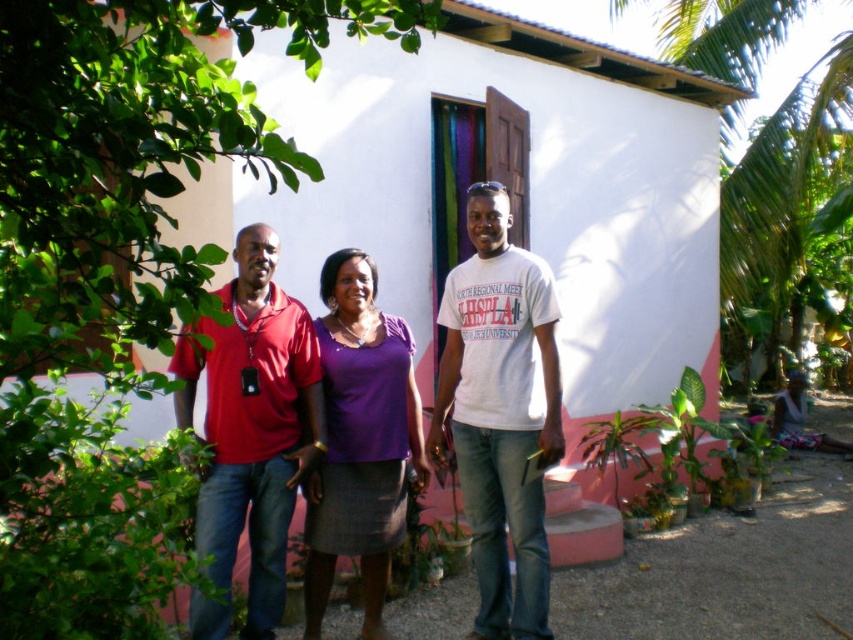
Question: Does white cotton t-shirt at center appear on the left side of matte red shirt at left?

Choices:
 (A) yes
 (B) no

Answer: (B)

Question: Does white cotton t-shirt at center have a smaller size compared to matte red shirt at left?

Choices:
 (A) yes
 (B) no

Answer: (B)

Question: Among these objects, which one is nearest to the camera?

Choices:
 (A) matte red shirt at center
 (B) matte red shirt at left

Answer: (B)

Question: Among these points, which one is farthest from the camera?

Choices:
 (A) (358, 364)
 (B) (305, 532)
 (C) (479, 624)
 (D) (235, 465)

Answer: (C)

Question: Is white cotton t-shirt at center above matte red shirt at left?

Choices:
 (A) no
 (B) yes

Answer: (B)

Question: Considering the real-world distances, which object is closest to the purple matte shirt at center?

Choices:
 (A) matte red shirt at left
 (B) white cotton t-shirt at center
 (C) matte red shirt at center

Answer: (C)